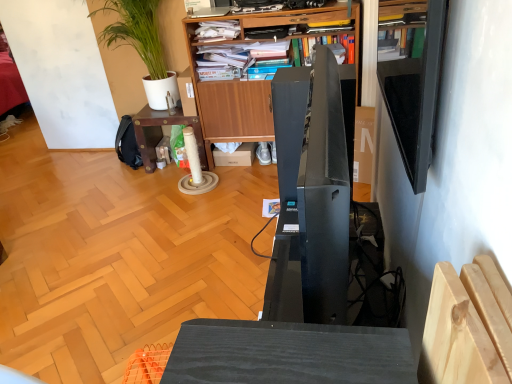
What do you see at coordinates (415, 96) in the screenshot? This screenshot has height=384, width=512. I see `black glossy shelf at upper right` at bounding box center [415, 96].

Measure the distance between wooden table at center and camera.

A distance of 3.05 meters exists between wooden table at center and camera.

The image size is (512, 384). I want to click on wooden table at center, so click(x=162, y=133).

This screenshot has width=512, height=384. Find the location of `green leafy plant at upper left`. green leafy plant at upper left is located at coordinates (121, 70).

In order to click on black glossy shelf at upper right in this screenshot , I will do `click(415, 96)`.

Is wooden table at center inside or outside of black glossy shelf at upper right?

wooden table at center cannot be found inside black glossy shelf at upper right.

Which of these two, wooden table at center or black glossy shelf at upper right, is thinner?

black glossy shelf at upper right is thinner.

Is wooden bookcase at upper center not inside black glossy speaker at center?

wooden bookcase at upper center is positioned outside black glossy speaker at center.

Looking at their sizes, would you say wooden bookcase at upper center is wider or thinner than black glossy speaker at center?

wooden bookcase at upper center is wider than black glossy speaker at center.

From a real-world perspective, which object rests below the other?

wooden bookcase at upper center, from a real-world perspective.

Which object is further away from the camera taking this photo, wooden bookcase at upper center or black glossy speaker at center?

Positioned behind is wooden bookcase at upper center.

Which object is wider, wooden table at center or black glossy speaker at center?

Wider between the two is wooden table at center.

Where is `appliance to the right of wooden table at center`? appliance to the right of wooden table at center is located at coordinates (311, 193).

From the image's perspective, does wooden table at center appear lower than black glossy speaker at center?

Incorrect, from the image's perspective, wooden table at center is higher than black glossy speaker at center.

From a real-world perspective, is wooden table at center positioned above or below black glossy speaker at center?

wooden table at center is below black glossy speaker at center.

Looking at this image, between green leafy plant at upper left and wooden bookcase at upper center, which one has larger width?

wooden bookcase at upper center.

From the picture: From the image's perspective, is green leafy plant at upper left positioned above or below wooden bookcase at upper center?

green leafy plant at upper left is above wooden bookcase at upper center.

Is green leafy plant at upper left inside or outside of wooden bookcase at upper center?

green leafy plant at upper left lies outside wooden bookcase at upper center.

Is point (333, 1) positioned after point (170, 1)?

No, (333, 1) is in front of (170, 1).

From a real-world perspective, who is located higher, wooden bookcase at upper center or green leafy plant at upper left?

green leafy plant at upper left.

Measure the distance from wooden bookcase at upper center to wooden table at center.

wooden bookcase at upper center is 12.52 inches from wooden table at center.

Is wooden bookcase at upper center aimed at wooden table at center?

No, wooden bookcase at upper center does not turn towards wooden table at center.

Is point (259, 130) closer to viewer compared to point (164, 118)?

Yes.

Identify the location of bookcase above the wooden table at center (from a real-world perspective). The width and height of the screenshot is (512, 384). (229, 104).

Is the position of green leafy plant at upper left less distant than that of black glossy shelf at upper right?

No, the depth of green leafy plant at upper left is greater than that of black glossy shelf at upper right.

Which of these two, green leafy plant at upper left or black glossy shelf at upper right, stands taller?

Standing taller between the two is green leafy plant at upper left.

Is green leafy plant at upper left not near black glossy shelf at upper right?

Yes, green leafy plant at upper left is far from black glossy shelf at upper right.

At what (x,y) coordinates should I click in order to perform the action: click on shelf located on the right of green leafy plant at upper left. Please return your answer as a coordinate pair (x, y). Looking at the image, I should click on (415, 96).

What are the coordinates of `table on the left of black glossy shelf at upper right` in the screenshot? It's located at (162, 133).

In order to click on appliance below the wooden bookcase at upper center (from the image's perspective) in this screenshot , I will do `click(311, 193)`.

Looking at the image, which one is located further to wooden table at center, green leafy plant at upper left or wooden bookcase at upper center?

Based on the image, green leafy plant at upper left appears to be further to wooden table at center.

From the image, which object appears to be nearer to green leafy plant at upper left, black glossy speaker at center or wooden table at center?

Among the two, wooden table at center is located nearer to green leafy plant at upper left.

Which object lies nearer to the anchor point black glossy shelf at upper right, green leafy plant at upper left or black glossy speaker at center?

The object closer to black glossy shelf at upper right is black glossy speaker at center.

Estimate the real-world distances between objects in this image. Which object is further from wooden bookcase at upper center, green leafy plant at upper left or black glossy speaker at center?

black glossy speaker at center lies further to wooden bookcase at upper center than the other object.

Looking at this image, looking at the image, which one is located closer to green leafy plant at upper left, black glossy shelf at upper right or wooden table at center?

wooden table at center is positioned closer to the anchor green leafy plant at upper left.

Which object lies nearer to the anchor point black glossy speaker at center, green leafy plant at upper left or wooden bookcase at upper center?

Among the two, wooden bookcase at upper center is located nearer to black glossy speaker at center.

Looking at the image, which one is located further to wooden bookcase at upper center, black glossy shelf at upper right or black glossy speaker at center?

black glossy shelf at upper right is further to wooden bookcase at upper center.

Based on their spatial positions, is green leafy plant at upper left or wooden table at center closer to black glossy shelf at upper right?

wooden table at center lies closer to black glossy shelf at upper right than the other object.

You are a GUI agent. You are given a task and a screenshot of the screen. Output one action in this format:
    pyautogui.click(x=<x>, y=<y>)
    Task: Click on the shelf positioned between black glossy speaker at center and wooden table at center from near to far
    The width and height of the screenshot is (512, 384).
    Given the screenshot: What is the action you would take?
    point(415,96)

This screenshot has width=512, height=384. What are the coordinates of `table situated between green leafy plant at upper left and wooden bookcase at upper center from left to right` in the screenshot? It's located at (162, 133).

Find the location of a particular element. This screenshot has width=512, height=384. bookcase between black glossy speaker at center and green leafy plant at upper left along the z-axis is located at coordinates (229, 104).

What are the coordinates of `bookcase between black glossy speaker at center and wooden table at center from front to back` in the screenshot? It's located at (229, 104).